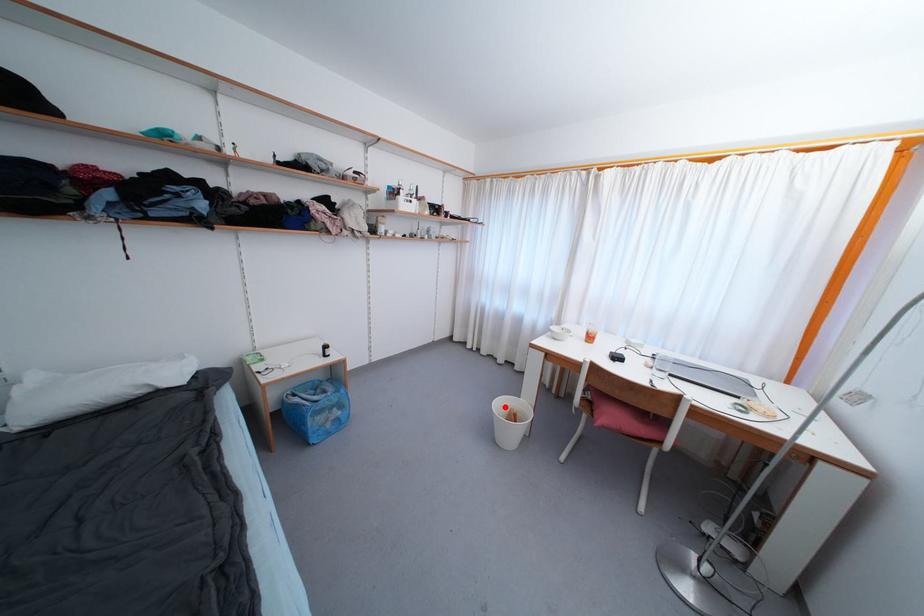
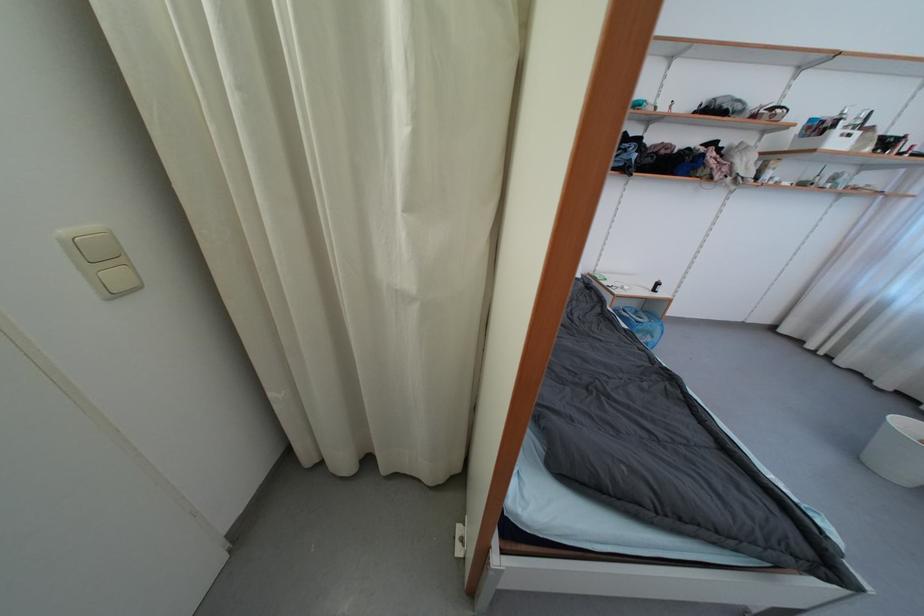
The point at the highlighted location is marked in the first image. Where is the corresponding point in the second image?

(912, 428)